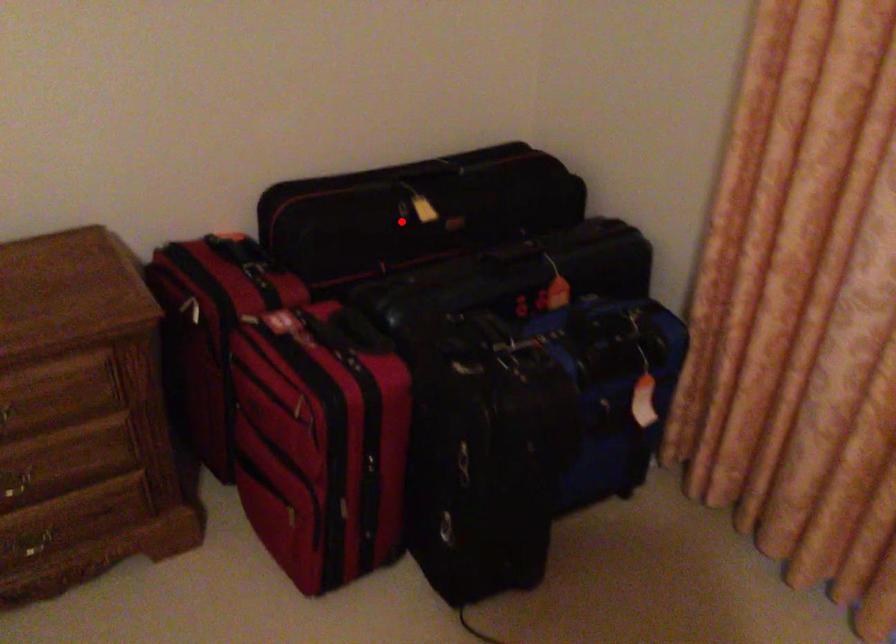
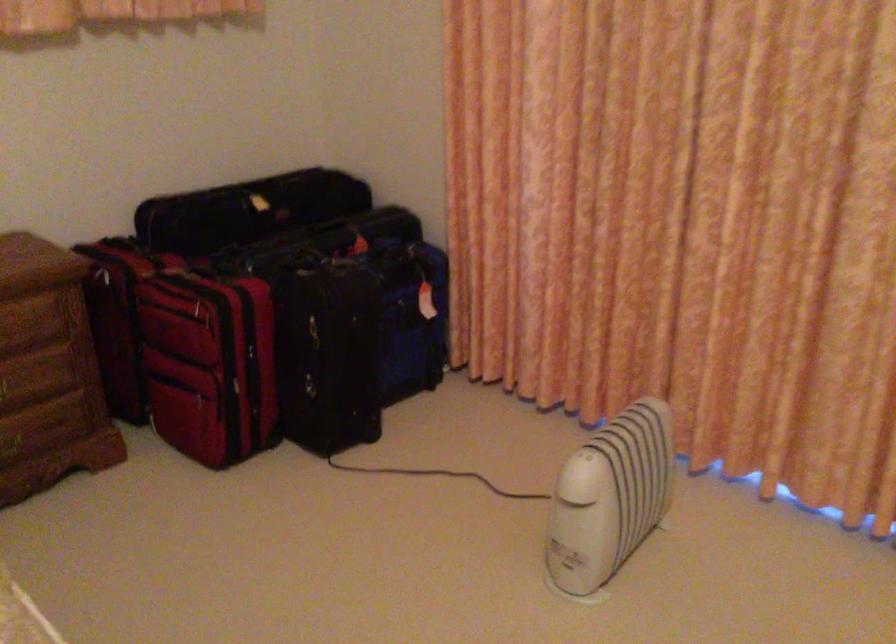
Question: I am providing you with two images of the same scene from different viewpoints. In image1, a red point is highlighted. Considering the same 3D point in image2, which of the following is correct?

Choices:
 (A) It is closer
 (B) It is farther

Answer: (B)